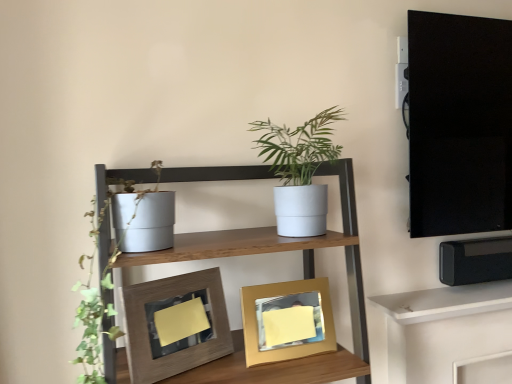
Question: Choose the correct answer: Is white matte shelf at upper right, marked as the 2th shelf in a front-to-back arrangement, inside matte white pot at left or outside it?

Choices:
 (A) outside
 (B) inside

Answer: (A)

Question: From their relative heights in the image, would you say white matte shelf at upper right, the first shelf in the back-to-front sequence, is taller or shorter than matte white pot at left?

Choices:
 (A) tall
 (B) short

Answer: (B)

Question: Based on their relative distances, which object is nearer to the matte white shelf at center, which is the first shelf from front to back?

Choices:
 (A) gold metallic picture frame at center, the first picture frame in the right-to-left sequence
 (B) white matte shelf at upper right, marked as the 2th shelf in a front-to-back arrangement
 (C) black glossy tv cabinet at upper right
 (D) wooden textured frame at center, the first picture frame in the left-to-right sequence
 (E) matte white pot at left

Answer: (E)

Question: Estimate the real-world distances between objects in this image. Which object is closer to the matte white shelf at center, which is the first shelf from front to back?

Choices:
 (A) black glossy tv cabinet at upper right
 (B) white matte shelf at upper right, which is the first shelf from bottom to top
 (C) matte white pot at left
 (D) wooden textured frame at center, which appears as the 2th picture frame when viewed from the right
 (E) white matte pot at center

Answer: (E)